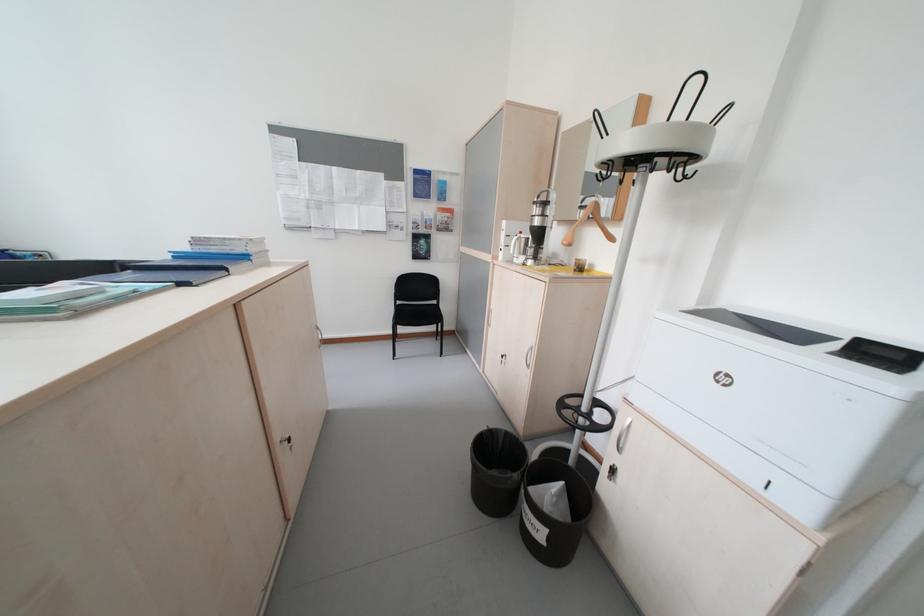
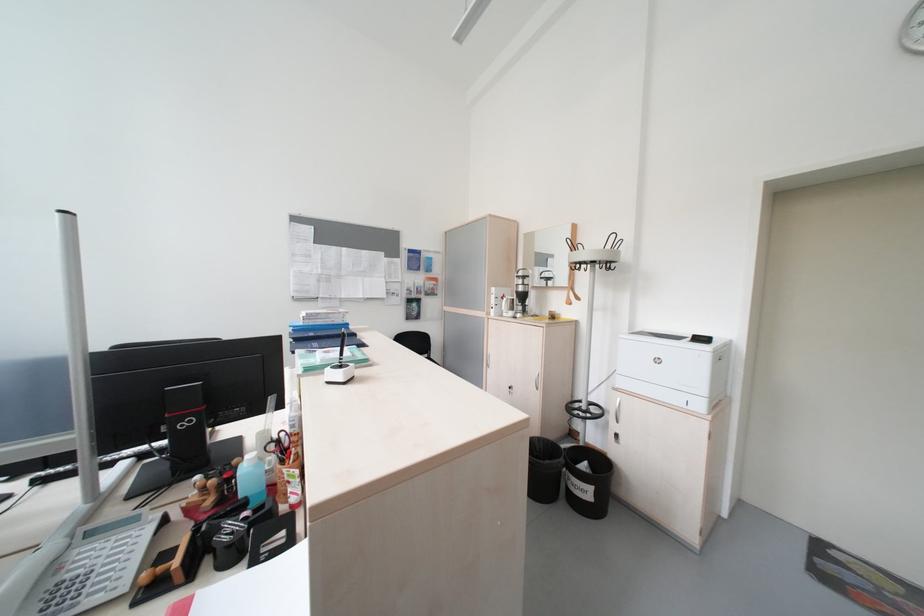
The point at (891, 355) is marked in the first image. Where is the corresponding point in the second image?

(711, 341)